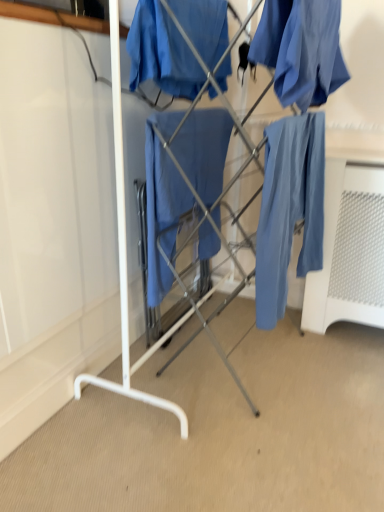
Locate an element on the screen. vacant area located to the right-hand side of matte blue fabric at center is located at coordinates (327, 366).